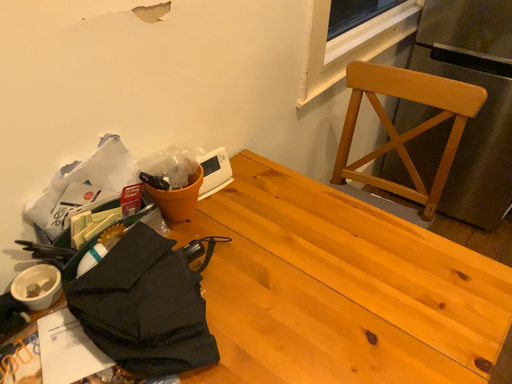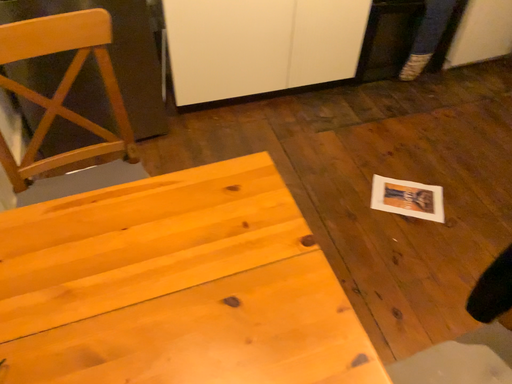
Question: How did the camera likely rotate when shooting the video?

Choices:
 (A) rotated upward
 (B) rotated downward

Answer: (A)